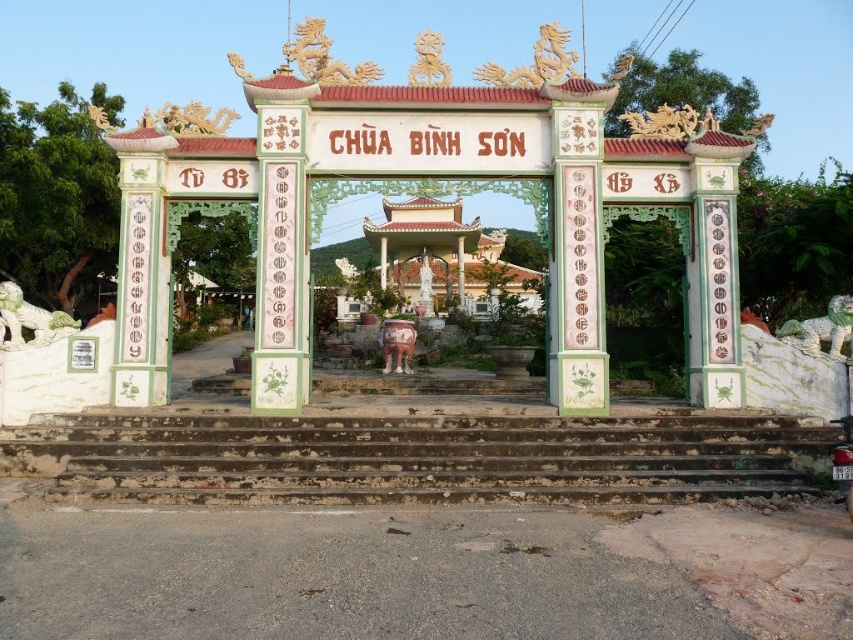
You are standing in front of the temple gate of Chua Binh Son. There are two points marked on the gate. One is at coordinate point (479, 481) and the other is at point (850, 304). Which point is closer to you?

Point (479, 481) is closer to the viewer than point (850, 304).